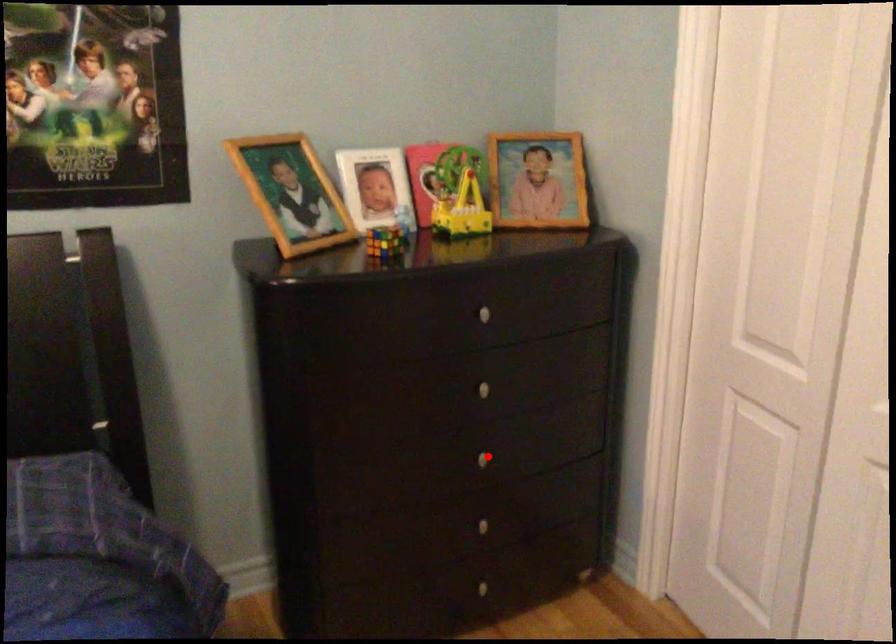
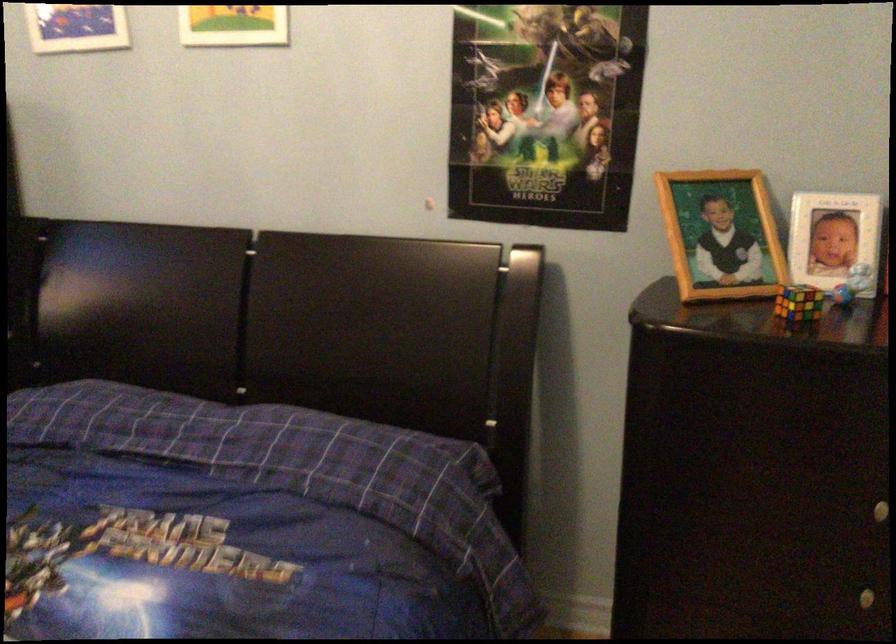
Question: I am providing you with two images of the same scene from different viewpoints. A red point is marked on the first image. At the location where the point appears in image 1, is it still visible in image 2?

Choices:
 (A) Yes
 (B) No

Answer: (A)